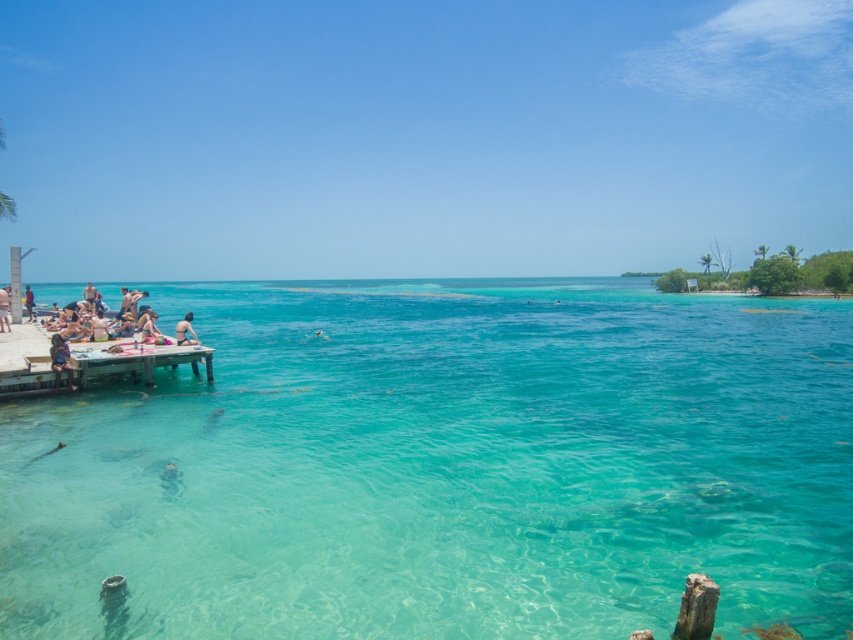
Does multicolored fabric bag at left have a lesser width compared to light brown skin at center?

Correct, multicolored fabric bag at left's width is less than light brown skin at center's.

Does multicolored fabric bag at left have a greater height compared to light brown skin at center?

Correct, multicolored fabric bag at left is much taller as light brown skin at center.

Image resolution: width=853 pixels, height=640 pixels. Find the location of `multicolored fabric bag at left`. multicolored fabric bag at left is located at coordinates (61, 360).

Can you confirm if clear water at center is positioned below light brown skin at center?

No, clear water at center is not below light brown skin at center.

From the picture: Does clear water at center have a lesser height compared to light brown skin at center?

In fact, clear water at center may be taller than light brown skin at center.

Is point (786, 506) positioned after point (189, 330)?

That is False.

Locate an element on the screen. The image size is (853, 640). clear water at center is located at coordinates (444, 467).

Can you confirm if multicolored fabric bag at left is positioned to the right of matte black person at left?

Indeed, multicolored fabric bag at left is positioned on the right side of matte black person at left.

This screenshot has height=640, width=853. Describe the element at coordinates (61, 360) in the screenshot. I see `multicolored fabric bag at left` at that location.

Identify the location of multicolored fabric bag at left. This screenshot has width=853, height=640. (61, 360).

Locate an element on the screen. This screenshot has width=853, height=640. multicolored fabric bag at left is located at coordinates [61, 360].